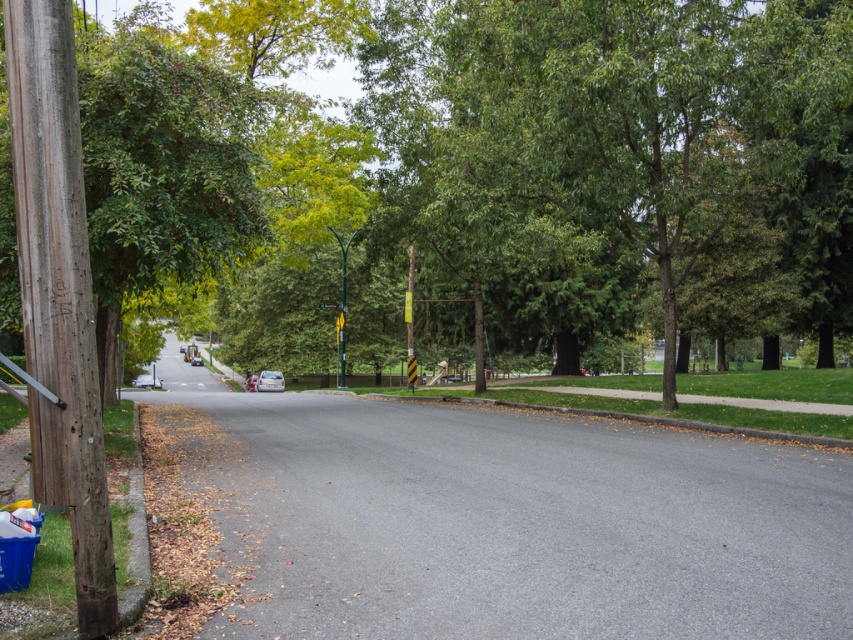
From the picture: You are a city planner designing a new bike path that needs to be placed between the green leafy tree at center and the weathered wood pole at left. The path must be exactly 15 meters long. Can the path fit between them without exceeding the space available?

The distance between the green leafy tree at center and the weathered wood pole at left is 17.78 meters. Since the required path length is 15 meters, which is shorter than the available distance, the path can fit between them without exceeding the space available.

You are a pedestrian standing on the sidewalk. You see the weathered wood pole at left and the metallic pole at center. Which pole is closer to the road on the right side?

The metallic pole at center is closer to the road on the right side because the weathered wood pole at left is to the left of the metallic pole at center, meaning the metallic pole is positioned between the wood pole and the road on the right.

You are a delivery person trying to navigate a narrow alley between two buildings. You see the weathered wood pole at left and the metallic pole at center. Which pole is closer to the ground?

The weathered wood pole at left is below metallic pole at center, so it is closer to the ground.